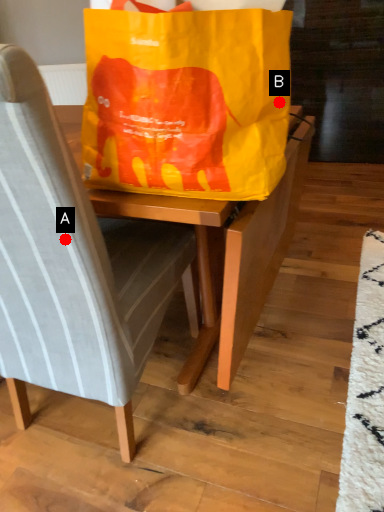
Question: Two points are circled on the image, labeled by A and B beside each circle. Among these points, which one is farthest from the camera?

Choices:
 (A) A is further
 (B) B is further

Answer: (A)